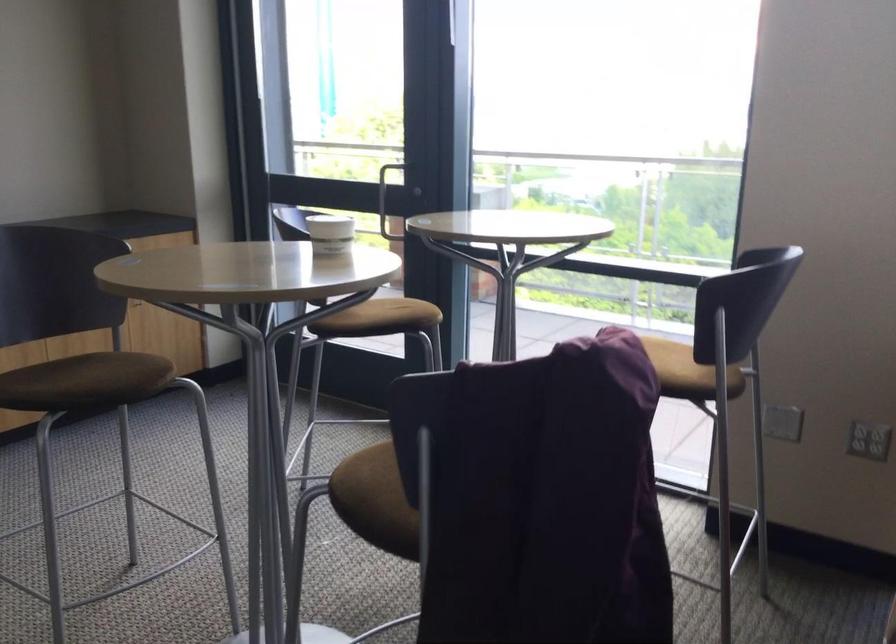
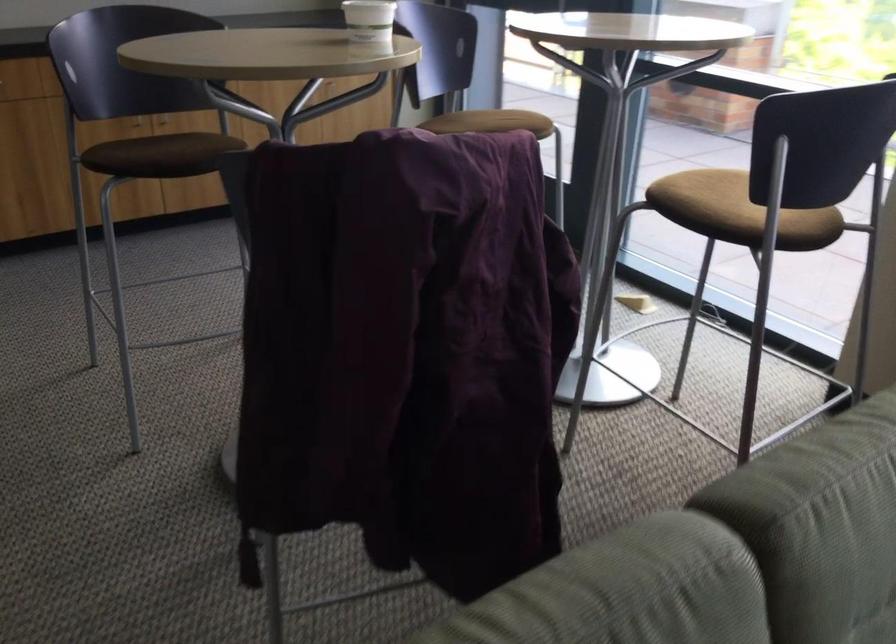
Where in the second image is the point corresponding to point (115, 384) from the first image?

(173, 160)